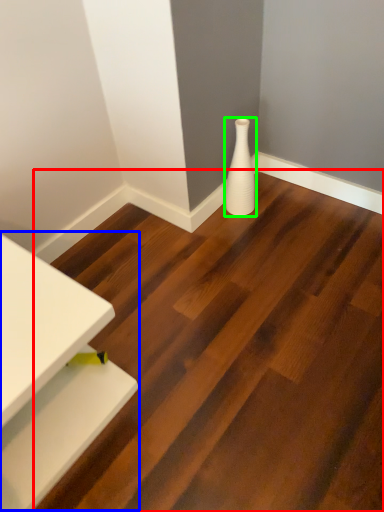
Question: Which object is the farthest from stair (highlighted by a red box)? Choose among these: table (highlighted by a blue box) or vase (highlighted by a green box).

Choices:
 (A) table
 (B) vase

Answer: (B)